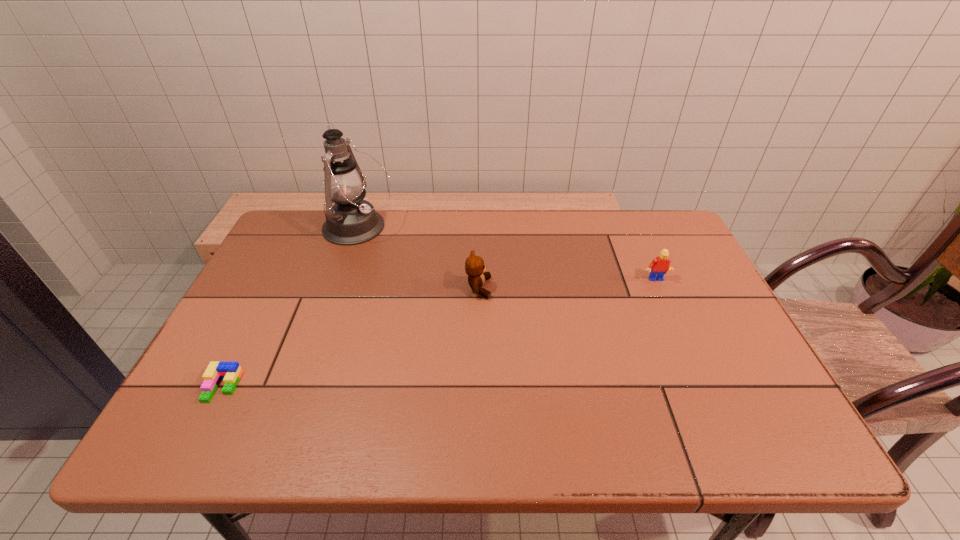
Image resolution: width=960 pixels, height=540 pixels. In order to click on free space located on the right of the shortest object in this screenshot , I will do `click(350, 387)`.

In order to click on object located at the far edge in this screenshot , I will do (351, 220).

I want to click on oil lamp located at the left edge, so click(x=351, y=220).

At what (x,y) coordinates should I click in order to perform the action: click on Lego that is at the left edge. Please return your answer as a coordinate pair (x, y). This screenshot has width=960, height=540. Looking at the image, I should click on (230, 372).

Locate an element on the screen. object that is at the right edge is located at coordinates (659, 266).

Locate an element on the screen. The width and height of the screenshot is (960, 540). object situated at the far left corner is located at coordinates (351, 220).

In the image, there is a desktop. Where is `vacant space at the far edge`? The image size is (960, 540). vacant space at the far edge is located at coordinates (559, 247).

In the image, there is a desktop. Where is `vacant area at the near edge`? vacant area at the near edge is located at coordinates (517, 450).

This screenshot has height=540, width=960. Find the location of `free space at the left edge of the desktop`. free space at the left edge of the desktop is located at coordinates (228, 360).

This screenshot has height=540, width=960. In order to click on free region at the right edge of the desktop in this screenshot , I will do `click(686, 271)`.